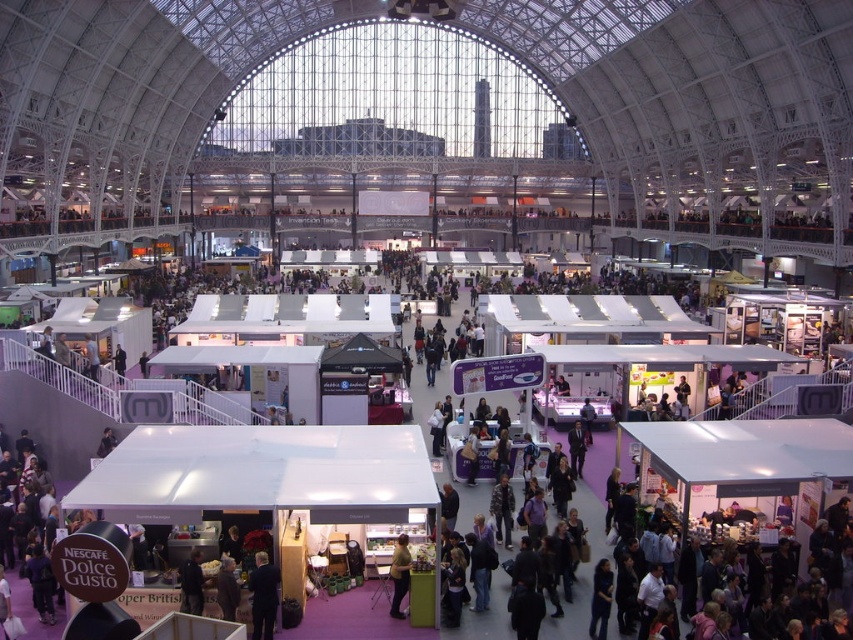
Can you confirm if dark blue suit at lower center is taller than matte yellow shirt at center?

Yes.

Does point (252, 634) lie behind point (407, 556)?

No, (252, 634) is closer to viewer.

Who is more forward, [267,636] or [397,554]?

Point [267,636] is more forward.

Identify the location of dark blue suit at lower center. (263, 595).